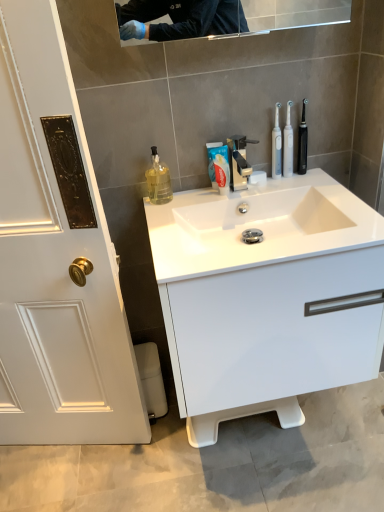
Question: Considering the relative sizes of translucent plastic mouthwash at center, which is the 2th mouthwash from left to right, and black plastic toothbrush at right, which appears as the 1th toothbrush when viewed from the right, in the image provided, is translucent plastic mouthwash at center, which is the 2th mouthwash from left to right, shorter than black plastic toothbrush at right, which appears as the 1th toothbrush when viewed from the right,?

Choices:
 (A) no
 (B) yes

Answer: (A)

Question: Is translucent plastic mouthwash at center, which is the 2th mouthwash from left to right, facing towards black plastic toothbrush at right, which appears as the 1th toothbrush when viewed from the right?

Choices:
 (A) yes
 (B) no

Answer: (B)

Question: Is the depth of translucent plastic mouthwash at center, the 1th mouthwash when ordered from right to left, less than that of black plastic toothbrush at right, the 2th toothbrush positioned from the left?

Choices:
 (A) no
 (B) yes

Answer: (B)

Question: Does translucent plastic mouthwash at center, which is the 2th mouthwash from left to right, have a larger size compared to black plastic toothbrush at right, the 2th toothbrush positioned from the left?

Choices:
 (A) yes
 (B) no

Answer: (A)

Question: Is translucent plastic mouthwash at center, which is the 2th mouthwash from left to right, outside black plastic toothbrush at right, the 2th toothbrush positioned from the left?

Choices:
 (A) yes
 (B) no

Answer: (A)

Question: Is translucent plastic mouthwash at center, the 1th mouthwash when ordered from right to left, thinner than black plastic toothbrush at right, the 2th toothbrush positioned from the left?

Choices:
 (A) yes
 (B) no

Answer: (B)

Question: Is polished chrome faucet at center thinner than translucent glass mouthwash at left, which is the second mouthwash in right-to-left order?

Choices:
 (A) yes
 (B) no

Answer: (B)

Question: Does polished chrome faucet at center appear on the right side of translucent glass mouthwash at left, which is the second mouthwash in right-to-left order?

Choices:
 (A) yes
 (B) no

Answer: (A)

Question: Does polished chrome faucet at center have a lesser height compared to translucent glass mouthwash at left, the 1th mouthwash positioned from the left?

Choices:
 (A) yes
 (B) no

Answer: (B)

Question: From a real-world perspective, is polished chrome faucet at center beneath translucent glass mouthwash at left, the 1th mouthwash positioned from the left?

Choices:
 (A) yes
 (B) no

Answer: (A)

Question: Considering the relative positions of polished chrome faucet at center and translucent glass mouthwash at left, which is the second mouthwash in right-to-left order, in the image provided, is polished chrome faucet at center to the left of translucent glass mouthwash at left, which is the second mouthwash in right-to-left order, from the viewer's perspective?

Choices:
 (A) yes
 (B) no

Answer: (B)

Question: Can translucent glass mouthwash at left, the 1th mouthwash positioned from the left, be found inside polished chrome faucet at center?

Choices:
 (A) no
 (B) yes

Answer: (A)

Question: Does polished chrome faucet at center have a lesser width compared to white glossy sink at center?

Choices:
 (A) yes
 (B) no

Answer: (A)